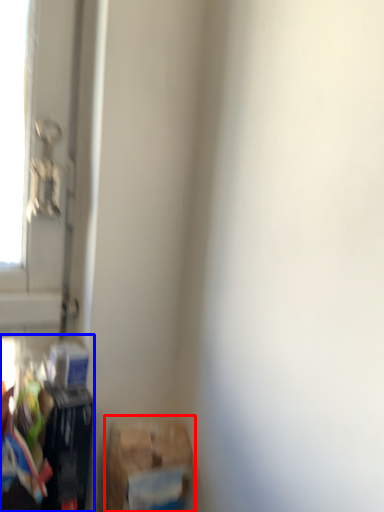
Question: Which object is further to the camera taking this photo, waste (highlighted by a red box) or waste (highlighted by a blue box)?

Choices:
 (A) waste
 (B) waste

Answer: (B)